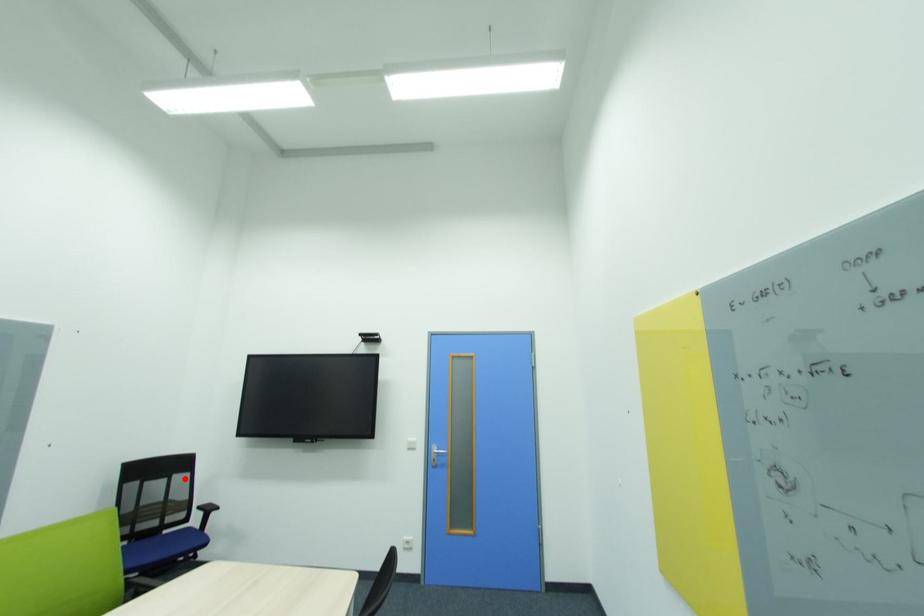
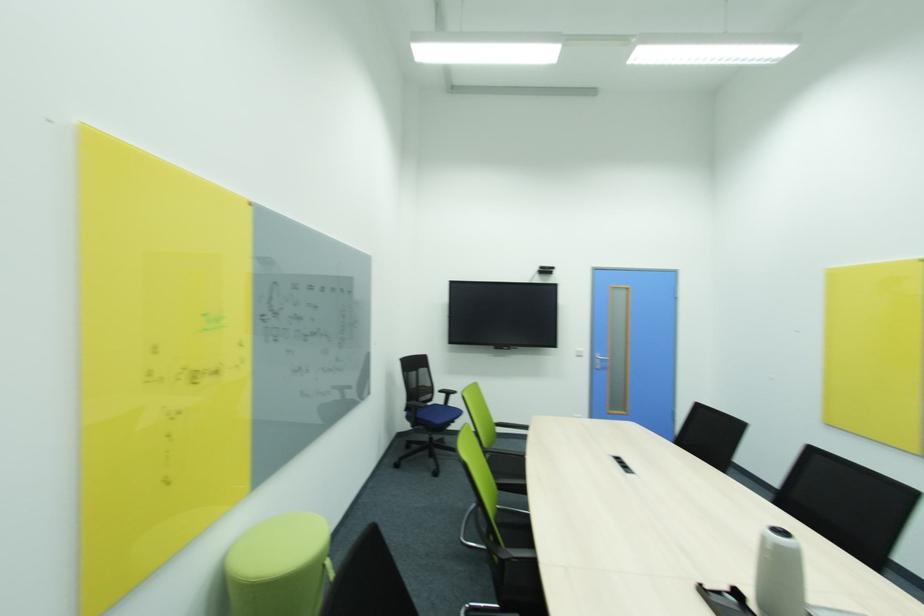
The point at the highlighted location is marked in the first image. Where is the corresponding point in the second image?

(428, 371)